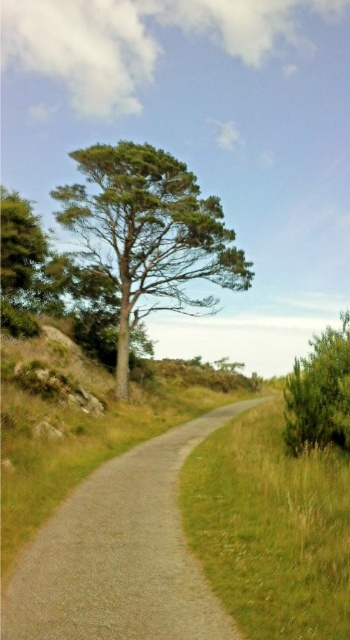
Which is in front, point (87, 488) or point (289, 428)?

Point (87, 488)

Is gravel road at center to the right of green leafy bush at right from the viewer's perspective?

Incorrect, gravel road at center is not on the right side of green leafy bush at right.

Locate an element on the screen. gravel road at center is located at coordinates (121, 554).

Between green matte tree at center and green matte tree at left, which one has more height?

With more height is green matte tree at center.

Which is behind, point (123, 204) or point (31, 296)?

Point (31, 296)

Which is in front, point (110, 244) or point (49, 301)?

Point (110, 244)

You are a GUI agent. You are given a task and a screenshot of the screen. Output one action in this format:
    pyautogui.click(x=<x>, y=<y>)
    Task: Click on the green matte tree at center
    This screenshot has height=640, width=350.
    Given the screenshot: What is the action you would take?
    pyautogui.click(x=149, y=234)

Can you confirm if gravel road at center is wider than green matte tree at left?

No, gravel road at center is not wider than green matte tree at left.

The height and width of the screenshot is (640, 350). Identify the location of gravel road at center. (121, 554).

This screenshot has width=350, height=640. I want to click on gravel road at center, so click(x=121, y=554).